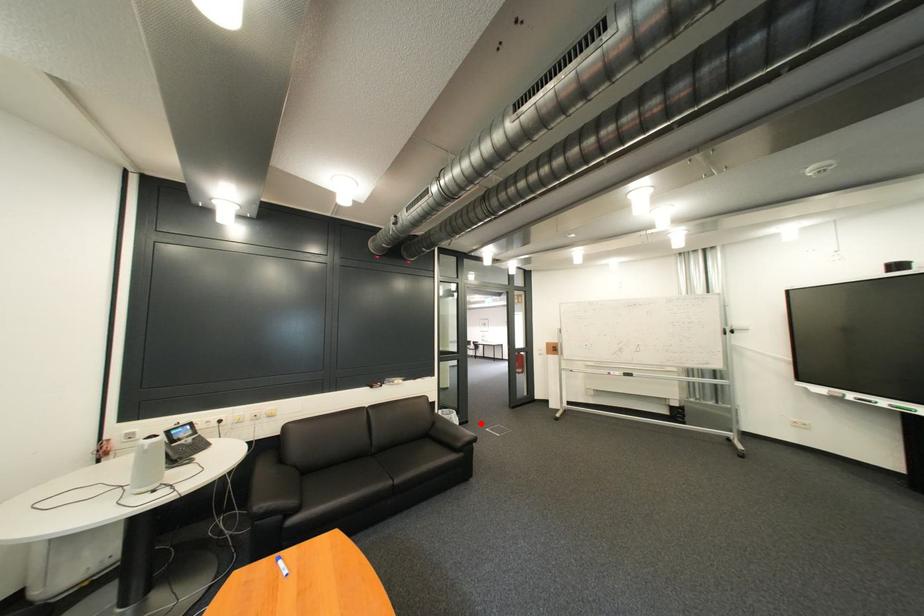
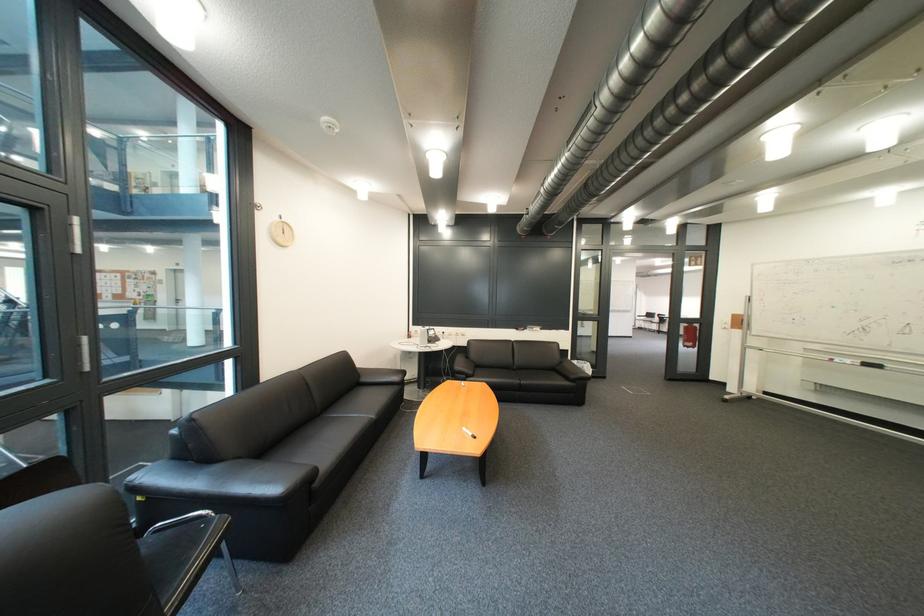
In the second image, find the point that corresponds to the highlighted location in the first image.

(618, 379)